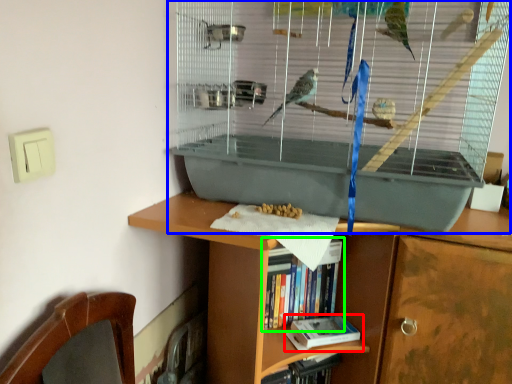
Question: Which is farther away from book (highlighted by a red box)? bird cage (highlighted by a blue box) or book (highlighted by a green box)?

Choices:
 (A) bird cage
 (B) book

Answer: (A)